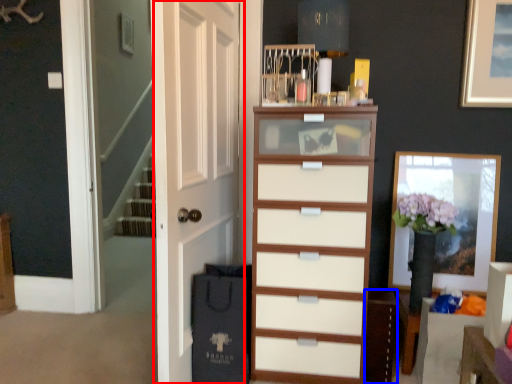
Question: Which object appears farthest to the camera in this image, door (highlighted by a red box) or cabinetry (highlighted by a blue box)?

Choices:
 (A) door
 (B) cabinetry

Answer: (B)